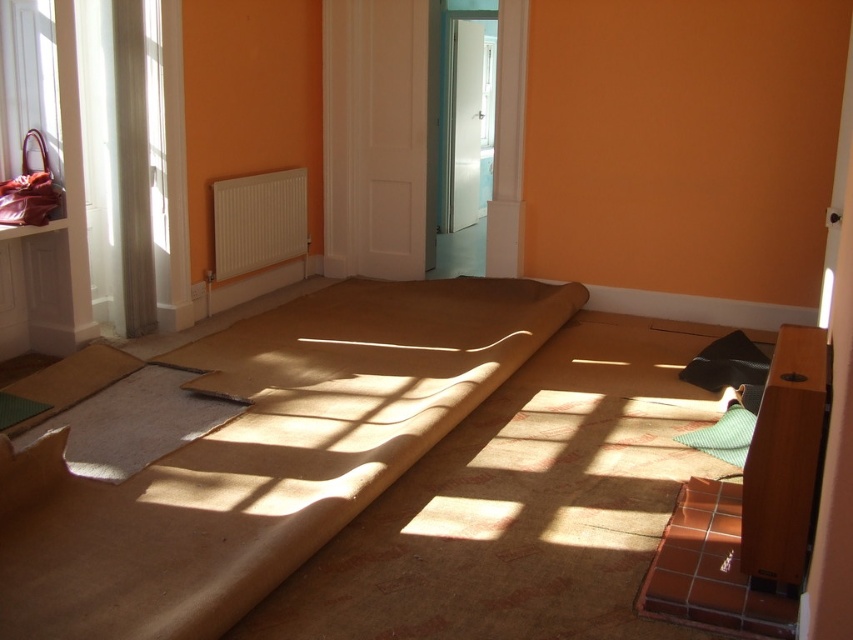
Question: Can you confirm if light gray felt mat at center is thinner than black matte pillow at lower right?

Choices:
 (A) no
 (B) yes

Answer: (A)

Question: Which point appears farthest from the camera in this image?

Choices:
 (A) (148, 45)
 (B) (693, 376)

Answer: (A)

Question: Which of the following is the farthest from the observer?

Choices:
 (A) white sheer curtain at left
 (B) white plastic radiator at center
 (C) black matte pillow at lower right
 (D) light gray felt mat at center

Answer: (B)

Question: Among these points, which one is nearest to the camera?

Choices:
 (A) (222, 196)
 (B) (83, 467)

Answer: (B)

Question: Is light gray felt mat at center above black matte pillow at lower right?

Choices:
 (A) no
 (B) yes

Answer: (A)

Question: Is white sheer curtain at left thinner than black matte pillow at lower right?

Choices:
 (A) no
 (B) yes

Answer: (B)